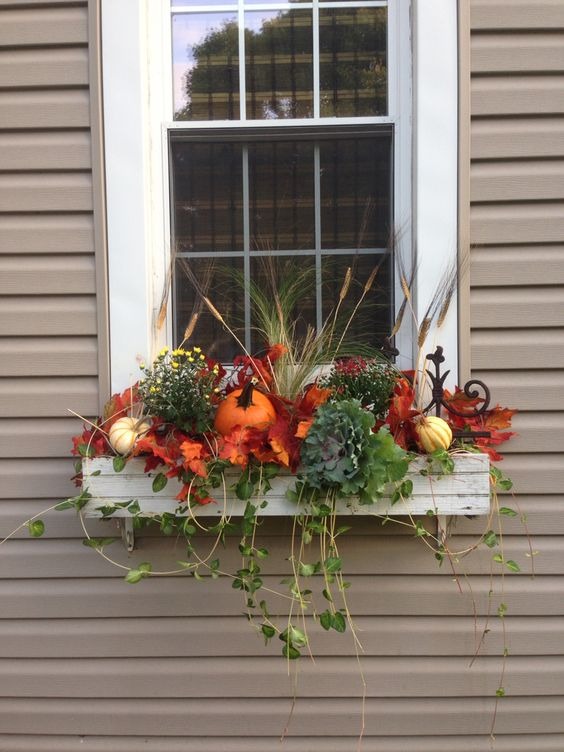
Locate an element on the screen. window box is located at coordinates (443, 492).